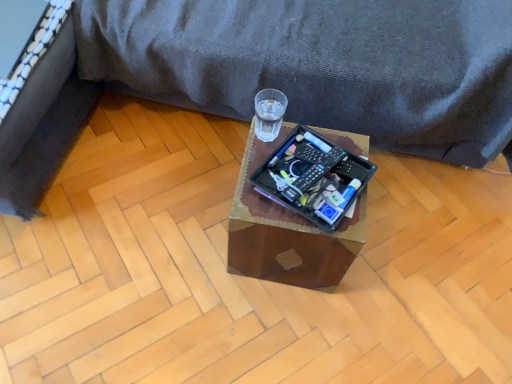
Question: Is black fabric bed frame at left closer to the viewer compared to wooden tray at center?

Choices:
 (A) yes
 (B) no

Answer: (A)

Question: From a real-world perspective, is black fabric bed frame at left positioned under wooden tray at center based on gravity?

Choices:
 (A) no
 (B) yes

Answer: (A)

Question: Is black fabric bed frame at left shorter than wooden tray at center?

Choices:
 (A) no
 (B) yes

Answer: (B)

Question: Does black fabric bed frame at left turn towards wooden tray at center?

Choices:
 (A) yes
 (B) no

Answer: (A)

Question: From a real-world perspective, is black fabric bed frame at left over wooden tray at center?

Choices:
 (A) no
 (B) yes

Answer: (B)

Question: Does black fabric bed frame at left appear on the right side of wooden tray at center?

Choices:
 (A) no
 (B) yes

Answer: (A)

Question: Is wooden tray at center bigger than black plastic remote control at center?

Choices:
 (A) no
 (B) yes

Answer: (B)

Question: Does wooden tray at center contain black plastic remote control at center?

Choices:
 (A) no
 (B) yes

Answer: (A)

Question: Is wooden tray at center behind black plastic remote control at center?

Choices:
 (A) no
 (B) yes

Answer: (B)

Question: Can you confirm if wooden tray at center is positioned to the left of black plastic remote control at center?

Choices:
 (A) no
 (B) yes

Answer: (B)

Question: Can you see wooden tray at center touching black plastic remote control at center?

Choices:
 (A) yes
 (B) no

Answer: (B)

Question: From the image's perspective, is wooden tray at center above black plastic remote control at center?

Choices:
 (A) no
 (B) yes

Answer: (A)

Question: Is black plastic remote control at center located outside transparent glass at center?

Choices:
 (A) no
 (B) yes

Answer: (B)